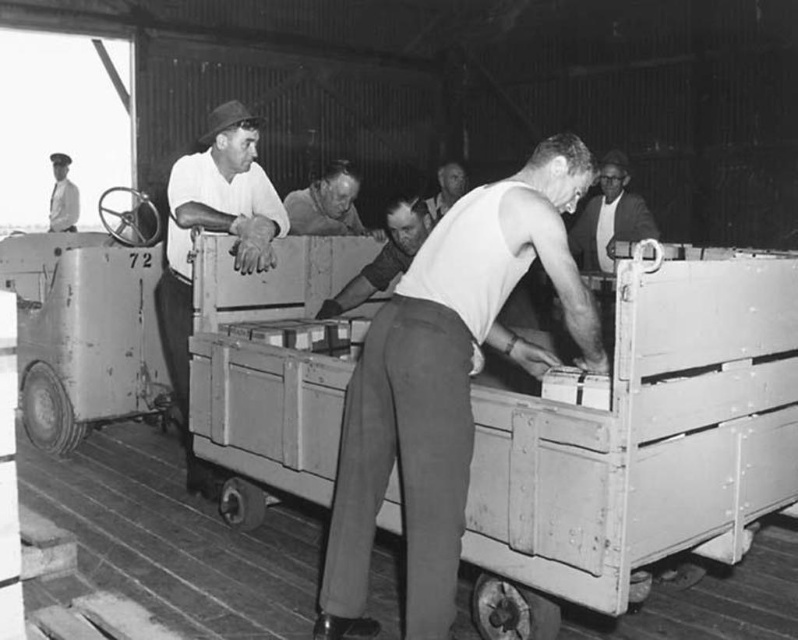
What do you see at coordinates (445, 384) in the screenshot? The image size is (798, 640). I see `white smooth shirt at center` at bounding box center [445, 384].

Is point (419, 582) positioned in front of point (423, 202)?

Yes.

Who is more forward, (362, 627) or (440, 216)?

Point (362, 627)

At what (x,y) coordinates should I click in order to perform the action: click on white smooth shirt at center. Please return your answer as a coordinate pair (x, y). Looking at the image, I should click on (445, 384).

Is white smooth shirt at center bigger than uniformed man at upper left?

Correct, white smooth shirt at center is larger in size than uniformed man at upper left.

Image resolution: width=798 pixels, height=640 pixels. What are the coordinates of `white smooth shirt at center` in the screenshot? It's located at (445, 384).

Identify the location of white smooth shirt at center. The height and width of the screenshot is (640, 798). (445, 384).

Consider the image. Can you confirm if matte white shirt at center is positioned below smooth white shirt at center?

Indeed, matte white shirt at center is positioned under smooth white shirt at center.

Can you confirm if matte white shirt at center is positioned to the left of smooth white shirt at center?

Indeed, matte white shirt at center is positioned on the left side of smooth white shirt at center.

Between point (188, 269) and point (451, 163), which one is positioned in front?

Point (188, 269) is more forward.

The width and height of the screenshot is (798, 640). What are the coordinates of `matte white shirt at center` in the screenshot? It's located at (214, 230).